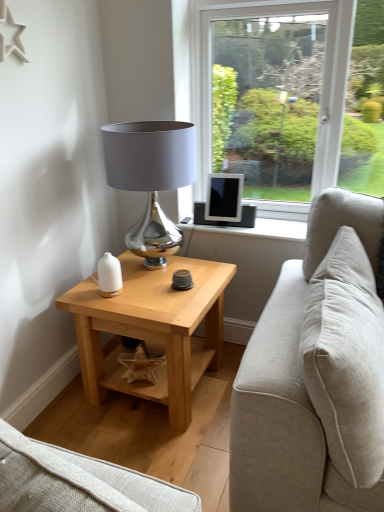
Question: Does beige fabric pillow at right have a lesser width compared to shiny metallic lampshade at center?

Choices:
 (A) no
 (B) yes

Answer: (B)

Question: Can you confirm if beige fabric pillow at right is bigger than shiny metallic lampshade at center?

Choices:
 (A) yes
 (B) no

Answer: (A)

Question: Is beige fabric pillow at right outside of shiny metallic lampshade at center?

Choices:
 (A) yes
 (B) no

Answer: (A)

Question: From the image's perspective, is beige fabric pillow at right located beneath shiny metallic lampshade at center?

Choices:
 (A) no
 (B) yes

Answer: (B)

Question: Is beige fabric pillow at right next to shiny metallic lampshade at center?

Choices:
 (A) no
 (B) yes

Answer: (A)

Question: From a real-world perspective, is beige fabric pillow at right on top of shiny metallic lampshade at center?

Choices:
 (A) yes
 (B) no

Answer: (B)

Question: Could you tell me if light wood/texture side table at lower left is facing matte black tablet at upper right?

Choices:
 (A) yes
 (B) no

Answer: (B)

Question: Is light wood/texture side table at lower left wider than matte black tablet at upper right?

Choices:
 (A) no
 (B) yes

Answer: (B)

Question: Is light wood/texture side table at lower left positioned far away from matte black tablet at upper right?

Choices:
 (A) yes
 (B) no

Answer: (B)

Question: Is light wood/texture side table at lower left with matte black tablet at upper right?

Choices:
 (A) yes
 (B) no

Answer: (B)

Question: Does light wood/texture side table at lower left appear on the left side of matte black tablet at upper right?

Choices:
 (A) no
 (B) yes

Answer: (B)

Question: From the image's perspective, does light wood/texture side table at lower left appear higher than matte black tablet at upper right?

Choices:
 (A) no
 (B) yes

Answer: (A)

Question: Does light wood/texture side table at lower left have a lesser width compared to shiny metallic lampshade at center?

Choices:
 (A) no
 (B) yes

Answer: (A)